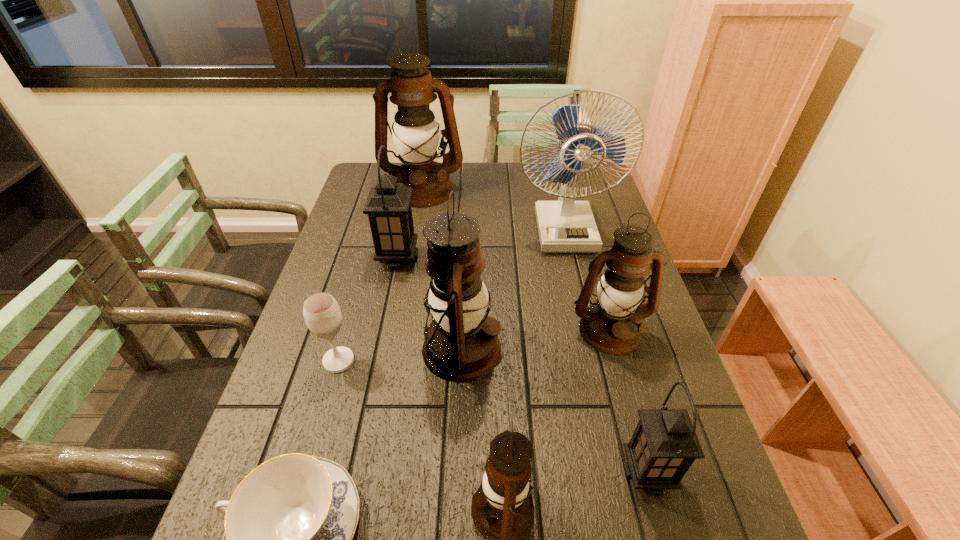
Identify which lantern is the third nearest to the second tallest lantern. Please provide its 2D coordinates. Your answer should be formatted as a tuple, i.e. [(x, y)], where the tuple contains the x and y coordinates of a point satisfying the conditions above.

[(611, 325)]

Locate an element on the screen. The image size is (960, 540). brown lantern that stands as the closest to the farthest brown lantern is located at coordinates (458, 299).

Identify which brown lantern is the fourth closest to the blue fan. Please provide its 2D coordinates. Your answer should be formatted as a tuple, i.e. [(x, y)], where the tuple contains the x and y coordinates of a point satisfying the conditions above.

[(502, 509)]

Where is `free region that satisfies the following two spatial constraints: 1. on the front side of the right black lantern; 2. on the right side of the second shortest object`? The width and height of the screenshot is (960, 540). free region that satisfies the following two spatial constraints: 1. on the front side of the right black lantern; 2. on the right side of the second shortest object is located at coordinates (306, 473).